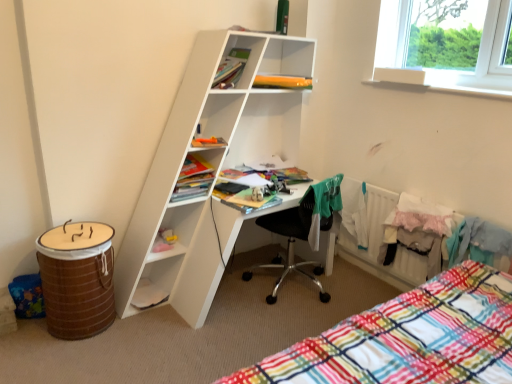
Locate an element on the screen. vacant area that lies between white matte desk at center and brown woven barrel at lower left is located at coordinates point(109,342).